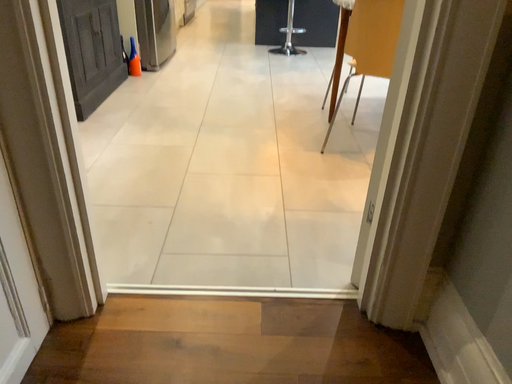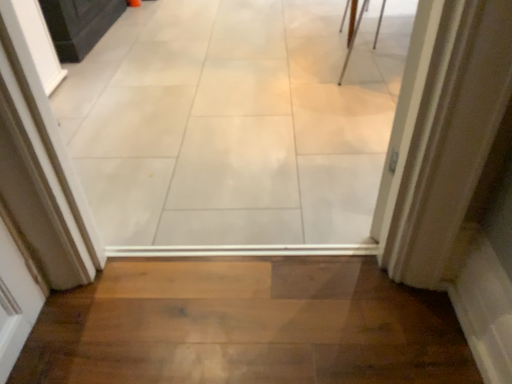
Question: Which way did the camera rotate in the video?

Choices:
 (A) rotated upward
 (B) rotated downward

Answer: (B)